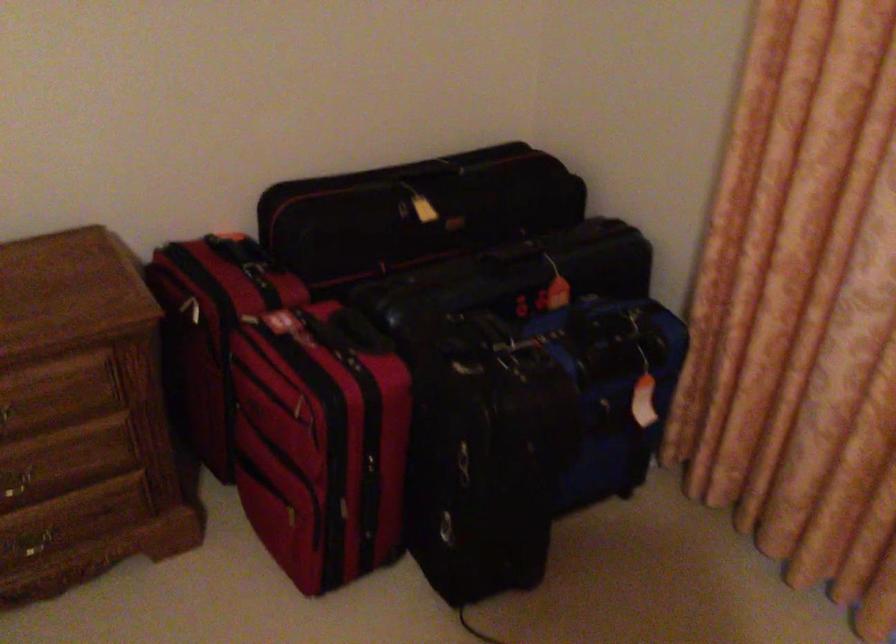
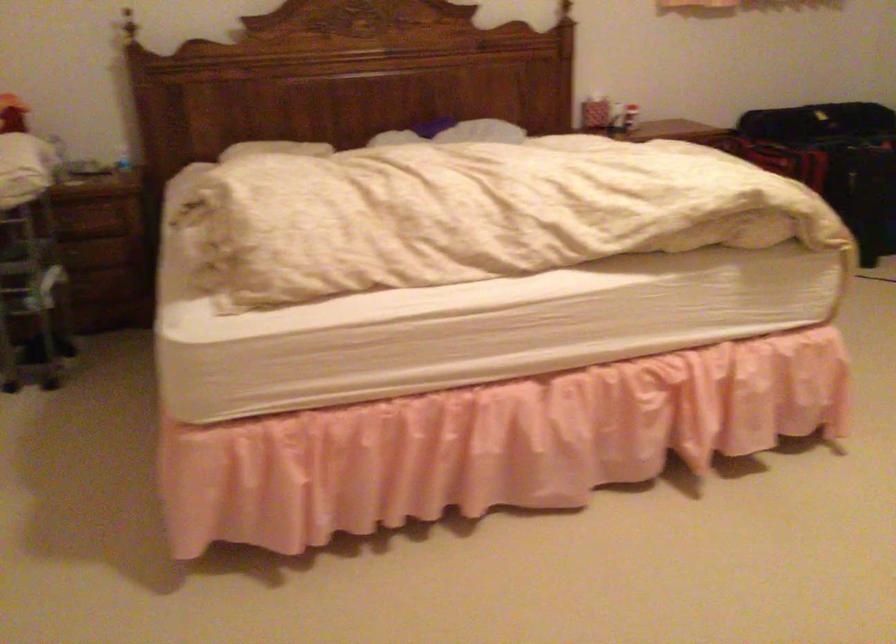
Question: Which direction would the cameraman need to move to produce the second image? Reply with the corresponding letter.

Choices:
 (A) Left
 (B) Right
 (C) Forward
 (D) Backward

Answer: (D)